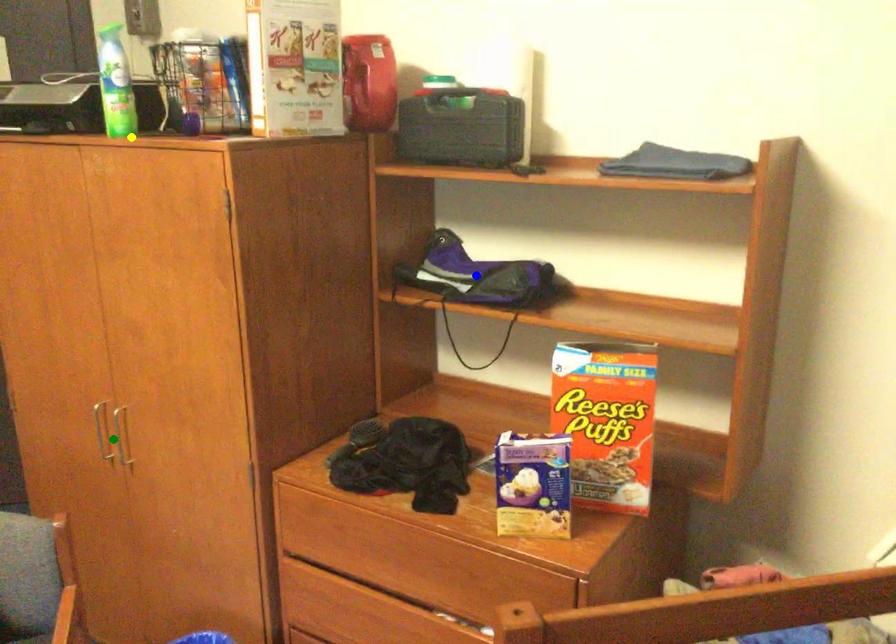
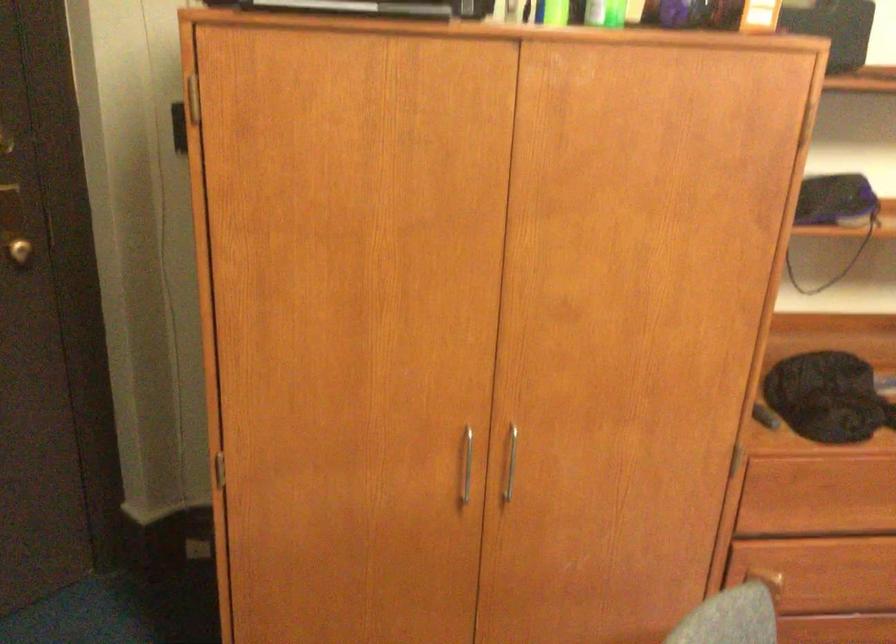
I am providing you with two images of the same scene from different viewpoints. Three points are marked in image1. Which point corresponds to a part or object that is occluded in image2?In image1, three points are marked. Which of them correspond to a part or object that is occluded in image2?Among the three points shown in image1, which one corresponds to a part or object that is no longer visible due to occlusion in image2?

Invisible in image2: blue point.